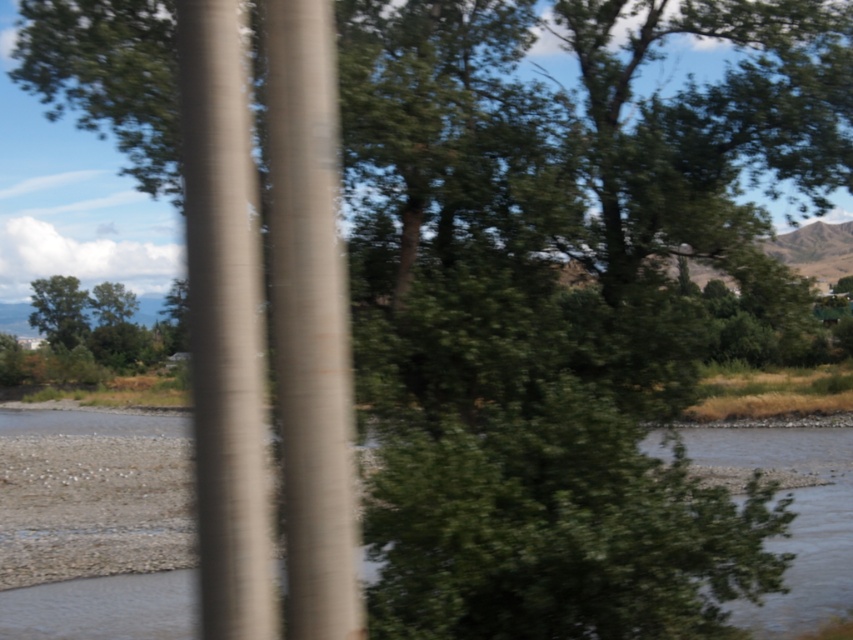
Describe the element at coordinates (309, 323) in the screenshot. I see `smooth concrete pole at center` at that location.

Consider the image. Does smooth concrete pole at center appear on the left side of smooth brown pole at center?

In fact, smooth concrete pole at center is to the right of smooth brown pole at center.

Between point (285, 406) and point (241, 580), which one is positioned in front?

Positioned in front is point (241, 580).

Image resolution: width=853 pixels, height=640 pixels. In order to click on smooth concrete pole at center in this screenshot , I will do `click(309, 323)`.

Is point (296, 408) closer to camera compared to point (45, 308)?

Yes, it is.

Who is higher up, smooth concrete pole at center or green leafy tree at left?

Positioned higher is green leafy tree at left.

At what (x,y) coordinates should I click in order to perform the action: click on smooth concrete pole at center. Please return your answer as a coordinate pair (x, y). Looking at the image, I should click on (309, 323).

Does point (238, 321) lie behind point (76, 323)?

No, (238, 321) is closer to viewer.

In the scene shown: Which of these two, smooth brown pole at center or green leafy tree at left, stands taller?

With more height is green leafy tree at left.

Is point (215, 518) less distant than point (47, 298)?

Yes.

You are a GUI agent. You are given a task and a screenshot of the screen. Output one action in this format:
    pyautogui.click(x=<x>, y=<y>)
    Task: Click on the smooth brown pole at center
    Image resolution: width=853 pixels, height=640 pixels.
    Given the screenshot: What is the action you would take?
    pyautogui.click(x=225, y=323)